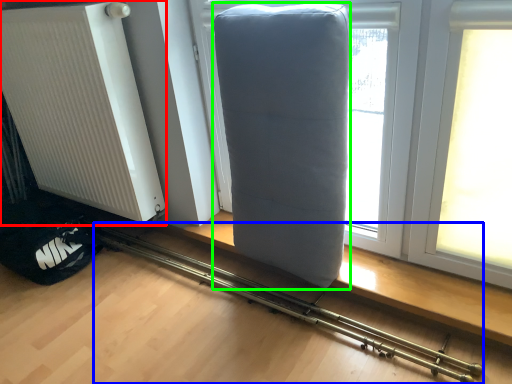
Question: Which object is the closest to the radiator (highlighted by a red box)? Choose among these: equipment (highlighted by a blue box) or furniture (highlighted by a green box).

Choices:
 (A) equipment
 (B) furniture

Answer: (A)